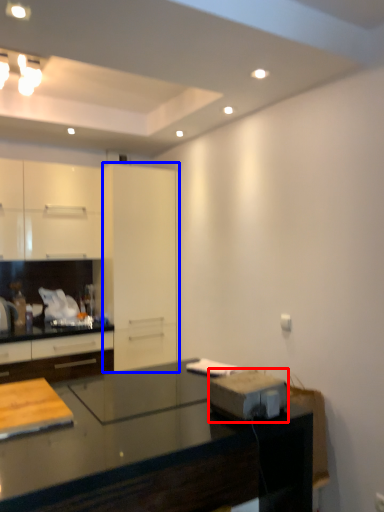
Question: Which point is further to the camera, appliance (highlighted by a red box) or glass door (highlighted by a blue box)?

Choices:
 (A) appliance
 (B) glass door

Answer: (B)